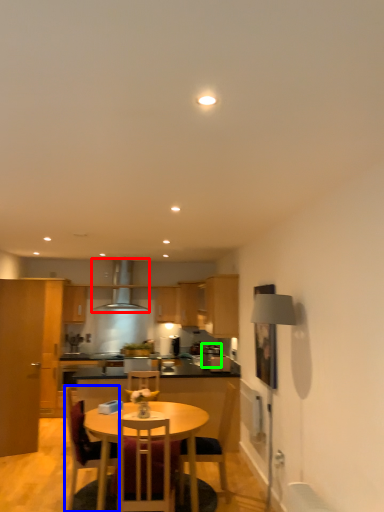
Question: Estimate the real-world distances between objects in this image. Which object is closer to exhaust hood (highlighted by a red box), chair (highlighted by a blue box) or appliance (highlighted by a green box)?

Choices:
 (A) chair
 (B) appliance

Answer: (B)